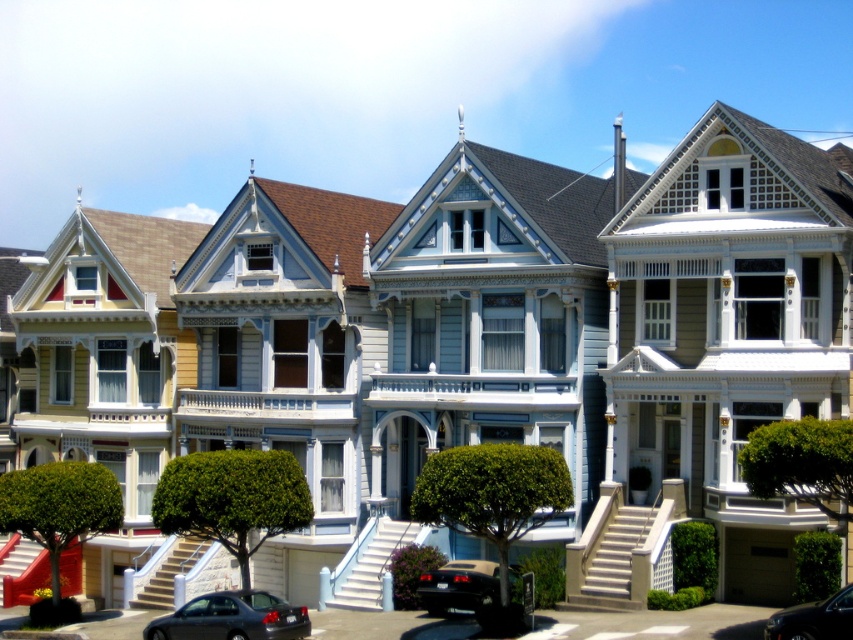
Does shiny black sedan at lower left have a greater height compared to shiny black car at center?

Correct, shiny black sedan at lower left is much taller as shiny black car at center.

Does shiny black sedan at lower left appear on the left side of shiny black car at center?

A: Yes, shiny black sedan at lower left is to the left of shiny black car at center.

Is point (270, 625) positioned behind point (779, 627)?

Yes, it is behind point (779, 627).

In order to click on shiny black sedan at lower left in this screenshot , I will do `click(231, 618)`.

Can you confirm if shiny black sedan at lower left is taller than shiny black car at lower center?

Yes.

This screenshot has width=853, height=640. Identify the location of shiny black sedan at lower left. (231, 618).

Find the location of a particular element. The height and width of the screenshot is (640, 853). shiny black sedan at lower left is located at coordinates (231, 618).

Between shiny black car at lower center and shiny black car at center, which one is positioned lower?

shiny black car at lower center is lower down.

Is shiny black car at lower center below shiny black car at center?

Indeed, shiny black car at lower center is positioned under shiny black car at center.

Where is `shiny black car at lower center`? The height and width of the screenshot is (640, 853). shiny black car at lower center is located at coordinates (457, 586).

Identify the location of shiny black car at lower center. (457, 586).